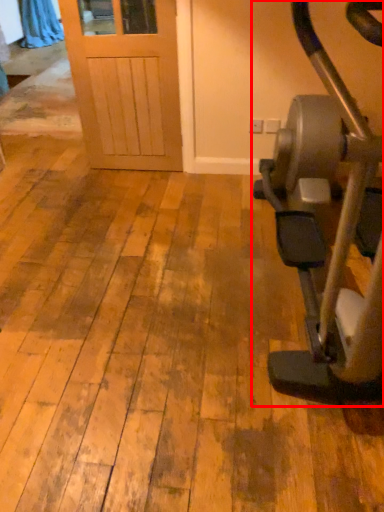
Question: From the image's perspective, considering the relative positions of stationary bicycle (annotated by the red box) and curtain in the image provided, where is stationary bicycle (annotated by the red box) located with respect to the staircase?

Choices:
 (A) above
 (B) below

Answer: (B)